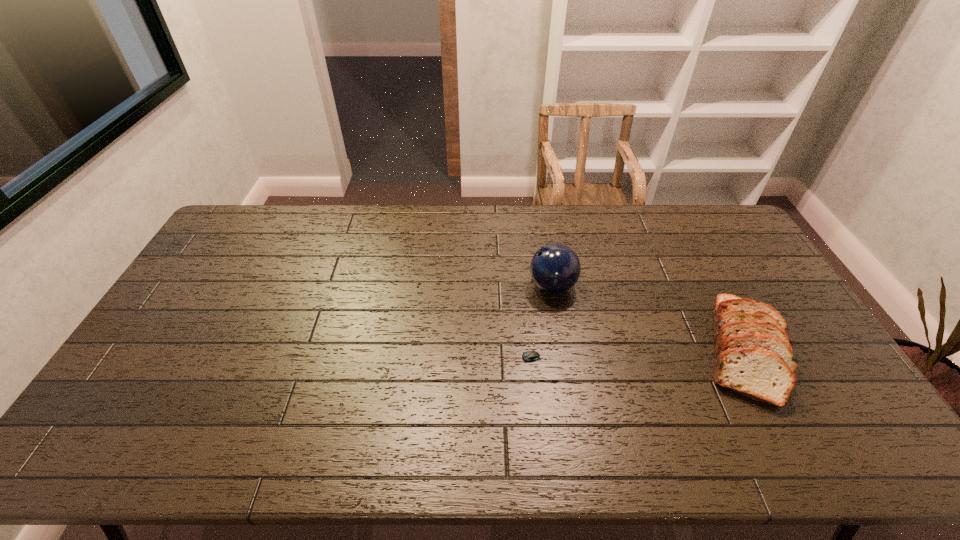
Where is `free space at the far edge of the desktop`? free space at the far edge of the desktop is located at coordinates (682, 228).

In the image, there is a desktop. Find the location of `free space at the near edge`. free space at the near edge is located at coordinates (476, 452).

Find the location of a particular element. free space at the left edge of the desktop is located at coordinates (228, 247).

At what (x,y) coordinates should I click in order to perform the action: click on free location at the right edge of the desktop. Please return your answer as a coordinate pair (x, y). The width and height of the screenshot is (960, 540). Looking at the image, I should click on (846, 422).

Where is `vacant area at the near left corner`? This screenshot has width=960, height=540. vacant area at the near left corner is located at coordinates (130, 443).

This screenshot has height=540, width=960. I want to click on free space at the far right corner of the desktop, so click(709, 241).

This screenshot has height=540, width=960. Find the location of `blank space at the near right corner of the desktop`. blank space at the near right corner of the desktop is located at coordinates (840, 454).

At what (x,y) coordinates should I click in order to perform the action: click on free spot between the rightmost object and the tallest object. Please return your answer as a coordinate pair (x, y). This screenshot has height=540, width=960. Looking at the image, I should click on (x=648, y=318).

You are a GUI agent. You are given a task and a screenshot of the screen. Output one action in this format:
    pyautogui.click(x=<x>, y=<y>)
    Task: Click on the free space that is in between the second shortest object and the mouse
    This screenshot has width=960, height=540.
    Given the screenshot: What is the action you would take?
    pyautogui.click(x=632, y=354)

Image resolution: width=960 pixels, height=540 pixels. What are the coordinates of `unoccupied area between the tallest object and the rightmost object` in the screenshot? It's located at (648, 318).